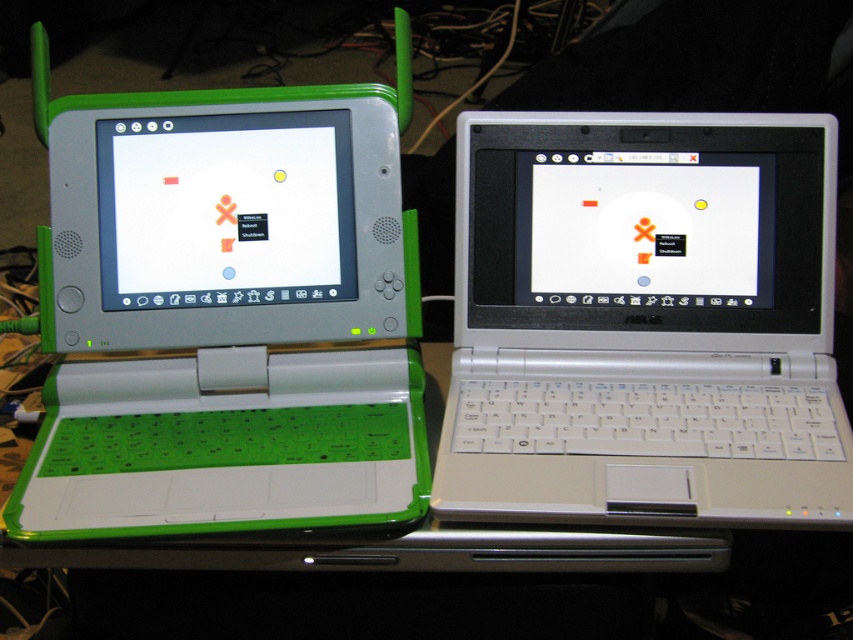
You are looking at the two laptops on the desk. There are two points marked on the screen of the left laptop. The first point is at coordinates point (64, 225) and the second point is at point (196, 200). Which point is closer to you?

Point (64, 225) is closer to the camera than point (196, 200).

You are a delivery robot with a width of 2.5 inches. You need to move between the green matte laptop at left and the green matte screen at left. Can you fit through the space between them?

The green matte laptop at left and the green matte screen at left are 2.44 inches apart from each other. Since the robot is 2.5 inches wide, it cannot fit through the space between them as the gap is narrower than the robot.

You are a delivery robot positioned at the origin point of the desk. You need to deliver a package to the white plastic laptop at center. What are the coordinates you should move to?

The white plastic laptop at center is located at coordinates point (643,321). Move to those coordinates to deliver the package.